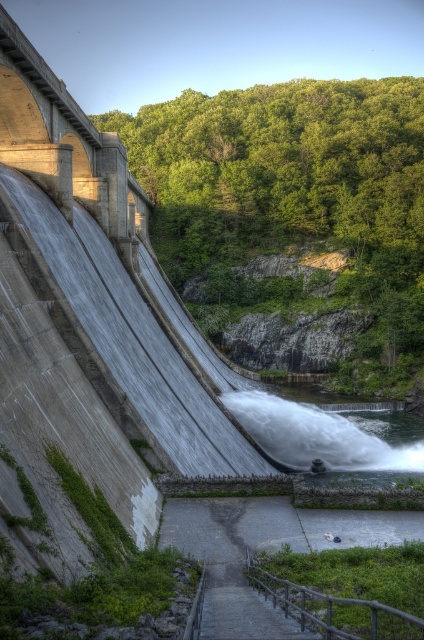
You are standing at the base of the dam and want to reach the point marked at coordinates point [63,129]. Given that the distance between you and this point is 94.11 meters, can you estimate how far you need to walk to reach it?

The distance between you and the point [63,129] is 94.11 meters, so you need to walk approximately 94.11 meters to reach it.

You are a photographer trying to capture the entire scene of the concrete bridge at left and the white frothy water at lower center in one shot. Given that your camera can only focus on one object at a time, which object should you prioritize focusing on to ensure it appears clearer in the photo?

You should prioritize focusing on the concrete bridge at left because it is bigger than the white frothy water at lower center, making it more likely to be in focus when the camera selects the focus point automatically.